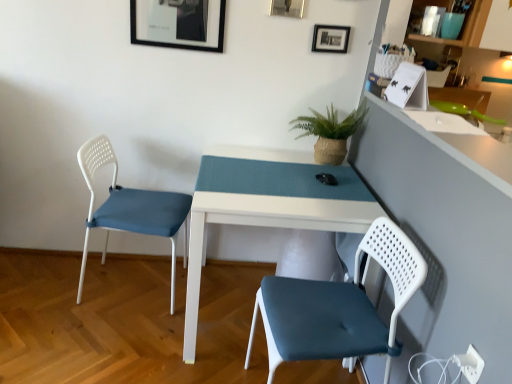
Question: From the image's perspective, is green woven pot at upper center under metallic silver picture frame at upper center, placed as the 2th picture frame when sorted from left to right?

Choices:
 (A) no
 (B) yes

Answer: (B)

Question: Is green woven pot at upper center positioned far away from metallic silver picture frame at upper center, placed as the 2th picture frame when sorted from left to right?

Choices:
 (A) yes
 (B) no

Answer: (B)

Question: Does green woven pot at upper center appear on the left side of metallic silver picture frame at upper center, acting as the second picture frame starting from the right?

Choices:
 (A) yes
 (B) no

Answer: (B)

Question: Could you tell me if green woven pot at upper center is turned towards metallic silver picture frame at upper center, acting as the second picture frame starting from the right?

Choices:
 (A) no
 (B) yes

Answer: (A)

Question: Is the position of green woven pot at upper center more distant than that of metallic silver picture frame at upper center, acting as the second picture frame starting from the right?

Choices:
 (A) yes
 (B) no

Answer: (A)

Question: Can you confirm if green woven pot at upper center is thinner than metallic silver picture frame at upper center, placed as the 2th picture frame when sorted from left to right?

Choices:
 (A) no
 (B) yes

Answer: (A)

Question: From the image's perspective, is matte white chair at lower right, which is the 1th chair in front-to-back order, above matte black picture frame at upper center, the first picture frame from the left?

Choices:
 (A) yes
 (B) no

Answer: (B)

Question: Considering the relative sizes of matte white chair at lower right, which is the 1th chair in front-to-back order, and matte black picture frame at upper center, marked as the 3th picture frame in a right-to-left arrangement, in the image provided, is matte white chair at lower right, which is the 1th chair in front-to-back order, smaller than matte black picture frame at upper center, marked as the 3th picture frame in a right-to-left arrangement,?

Choices:
 (A) no
 (B) yes

Answer: (A)

Question: From a real-world perspective, is matte white chair at lower right, marked as the second chair in a left-to-right arrangement, physically below matte black picture frame at upper center, the first picture frame from the left?

Choices:
 (A) no
 (B) yes

Answer: (B)

Question: Is matte white chair at lower right, the 1th chair from the right, next to matte black picture frame at upper center, the first picture frame from the left?

Choices:
 (A) no
 (B) yes

Answer: (A)

Question: Is matte white chair at lower right, the 1th chair from the right, looking in the opposite direction of matte black picture frame at upper center, marked as the 3th picture frame in a right-to-left arrangement?

Choices:
 (A) yes
 (B) no

Answer: (B)

Question: Can you confirm if matte white chair at lower right, which appears as the second chair when viewed from the back, is thinner than matte black picture frame at upper center, the first picture frame from the left?

Choices:
 (A) yes
 (B) no

Answer: (B)

Question: Does black matte picture frame at upper center, which is the 1th picture frame from right to left, have a lesser height compared to metallic silver picture frame at upper center, placed as the 2th picture frame when sorted from left to right?

Choices:
 (A) yes
 (B) no

Answer: (A)